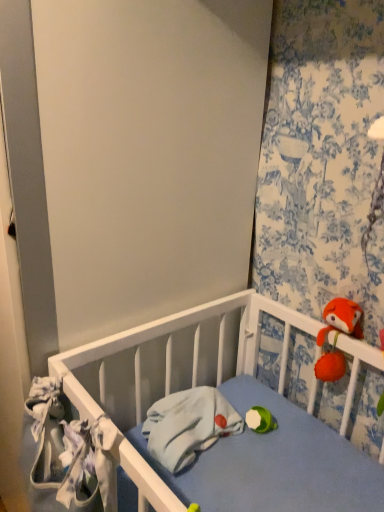
Image resolution: width=384 pixels, height=512 pixels. In order to click on fluffy orange plush at upper right in this screenshot , I will do `click(341, 319)`.

Describe the element at coordinates (322, 160) in the screenshot. I see `floral fabric curtain at upper right` at that location.

Measure the distance between point (50, 412) and camera.

Point (50, 412) is 33.27 inches away from camera.

At what (x,y) coordinates should I click in order to perform the action: click on fluffy orange plush at upper right. Please return your answer as a coordinate pair (x, y). Looking at the image, I should click on (341, 319).

How different are the orientations of fluffy orange plush at upper right and light blue fabric at center, which ranks as the second material in left-to-right order, in degrees?

fluffy orange plush at upper right and light blue fabric at center, which ranks as the second material in left-to-right order, are facing 90.9 degrees away from each other.

Considering the sizes of fluffy orange plush at upper right and light blue fabric at center, arranged as the first material when viewed from the right, in the image, is fluffy orange plush at upper right bigger or smaller than light blue fabric at center, arranged as the first material when viewed from the right,?

fluffy orange plush at upper right is smaller than light blue fabric at center, arranged as the first material when viewed from the right.

Which point is more forward, (x=354, y=334) or (x=159, y=453)?

Point (x=159, y=453)

Considering the relative sizes of fluffy orange plush at upper right and light blue fabric at center, which appears as the second material when viewed from the front, in the image provided, is fluffy orange plush at upper right thinner than light blue fabric at center, which appears as the second material when viewed from the front,?

Yes.

Can you confirm if fluffy orange plush at upper right is taller than white fabric at left, arranged as the second material when viewed from the right?

In fact, fluffy orange plush at upper right may be shorter than white fabric at left, arranged as the second material when viewed from the right.

The height and width of the screenshot is (512, 384). I want to click on material that is the 2nd object to the left of the fluffy orange plush at upper right, starting at the anchor, so click(x=65, y=453).

Measure the distance between fluffy orange plush at upper right and white fabric at left, positioned as the first material in front-to-back order.

fluffy orange plush at upper right is 23.30 inches from white fabric at left, positioned as the first material in front-to-back order.

From the image's perspective, between fluffy orange plush at upper right and white fabric at left, which is counted as the first material, starting from the left, who is located below?

From the image's view, white fabric at left, which is counted as the first material, starting from the left, is below.

Can we say light blue fabric at center, which is the 1th material in back-to-front order, lies outside fluffy orange plush at upper right?

Yes.

Considering the relative sizes of light blue fabric at center, which ranks as the second material in left-to-right order, and fluffy orange plush at upper right in the image provided, is light blue fabric at center, which ranks as the second material in left-to-right order, thinner than fluffy orange plush at upper right?

Incorrect, the width of light blue fabric at center, which ranks as the second material in left-to-right order, is not less than that of fluffy orange plush at upper right.

Does light blue fabric at center, which ranks as the second material in left-to-right order, appear on the right side of fluffy orange plush at upper right?

No.

Is light blue fabric at center, which is the 1th material in back-to-front order, turned away from fluffy orange plush at upper right?

No, light blue fabric at center, which is the 1th material in back-to-front order, is not facing away from fluffy orange plush at upper right.

From the image's perspective, is white fabric at left, marked as the 2th material in a back-to-front arrangement, below floral fabric curtain at upper right?

Yes, from the image's perspective, white fabric at left, marked as the 2th material in a back-to-front arrangement, is beneath floral fabric curtain at upper right.

Is white fabric at left, which is counted as the first material, starting from the left, wider than floral fabric curtain at upper right?

Indeed, white fabric at left, which is counted as the first material, starting from the left, has a greater width compared to floral fabric curtain at upper right.

Is white fabric at left, arranged as the second material when viewed from the right, smaller than floral fabric curtain at upper right?

Yes, white fabric at left, arranged as the second material when viewed from the right, is smaller than floral fabric curtain at upper right.

Considering the sizes of objects white fabric at left, positioned as the first material in front-to-back order, and floral fabric curtain at upper right in the image provided, who is shorter, white fabric at left, positioned as the first material in front-to-back order, or floral fabric curtain at upper right?

white fabric at left, positioned as the first material in front-to-back order, is shorter.

Is point (145, 434) behind point (367, 81)?

That is True.

Is light blue fabric at center, which is the 1th material in back-to-front order, not near floral fabric curtain at upper right?

No, light blue fabric at center, which is the 1th material in back-to-front order, is in close proximity to floral fabric curtain at upper right.

How different are the orientations of light blue fabric at center, which appears as the second material when viewed from the front, and floral fabric curtain at upper right in degrees?

The facing directions of light blue fabric at center, which appears as the second material when viewed from the front, and floral fabric curtain at upper right are 94.7 degrees apart.

This screenshot has width=384, height=512. I want to click on curtain lying on the right of light blue fabric at center, which ranks as the second material in left-to-right order, so click(322, 160).

The width and height of the screenshot is (384, 512). Identify the location of material lying behind the floral fabric curtain at upper right. (188, 425).

Who is smaller, floral fabric curtain at upper right or light blue fabric at center, which ranks as the second material in left-to-right order?

light blue fabric at center, which ranks as the second material in left-to-right order.

Is point (319, 125) positioned behind point (196, 434)?

No, (319, 125) is in front of (196, 434).

Which of these two, floral fabric curtain at upper right or light blue fabric at center, which ranks as the second material in left-to-right order, stands taller?

Standing taller between the two is floral fabric curtain at upper right.

Choose the correct answer: Is white fabric at left, positioned as the first material in front-to-back order, inside light blue fabric at center, which is the 1th material in back-to-front order, or outside it?

white fabric at left, positioned as the first material in front-to-back order, is spatially situated outside light blue fabric at center, which is the 1th material in back-to-front order.

Is the depth of white fabric at left, which is counted as the first material, starting from the left, less than that of light blue fabric at center, which is the 1th material in back-to-front order?

That is True.

From a real-world perspective, is white fabric at left, marked as the 2th material in a back-to-front arrangement, below light blue fabric at center, which ranks as the second material in left-to-right order?

Incorrect, from a real-world perspective, white fabric at left, marked as the 2th material in a back-to-front arrangement, is higher than light blue fabric at center, which ranks as the second material in left-to-right order.

This screenshot has width=384, height=512. I want to click on toy lying on the right of light blue fabric at center, which appears as the second material when viewed from the front, so click(341, 319).

The height and width of the screenshot is (512, 384). Find the location of `material that is the 1st one when counting downward from the fluffy orange plush at upper right (from the image's perspective)`. material that is the 1st one when counting downward from the fluffy orange plush at upper right (from the image's perspective) is located at coordinates (65, 453).

Consider the image. When comparing their distances from light blue fabric at center, which appears as the second material when viewed from the front, does floral fabric curtain at upper right or fluffy orange plush at upper right seem further?

Among the two, floral fabric curtain at upper right is located further to light blue fabric at center, which appears as the second material when viewed from the front.

Based on their spatial positions, is white fabric at left, positioned as the first material in front-to-back order, or light blue fabric at center, arranged as the first material when viewed from the right, further from floral fabric curtain at upper right?

white fabric at left, positioned as the first material in front-to-back order.

Estimate the real-world distances between objects in this image. Which object is further from floral fabric curtain at upper right, fluffy orange plush at upper right or light blue fabric at center, arranged as the first material when viewed from the right?

The object further to floral fabric curtain at upper right is light blue fabric at center, arranged as the first material when viewed from the right.

From the image, which object appears to be nearer to white fabric at left, which is counted as the first material, starting from the left, floral fabric curtain at upper right or light blue fabric at center, which ranks as the second material in left-to-right order?

light blue fabric at center, which ranks as the second material in left-to-right order, is closer to white fabric at left, which is counted as the first material, starting from the left.

Looking at the image, which one is located closer to fluffy orange plush at upper right, floral fabric curtain at upper right or light blue fabric at center, which appears as the second material when viewed from the front?

floral fabric curtain at upper right lies closer to fluffy orange plush at upper right than the other object.

Looking at the image, which one is located further to light blue fabric at center, which ranks as the second material in left-to-right order, fluffy orange plush at upper right or floral fabric curtain at upper right?

floral fabric curtain at upper right is positioned further to the anchor light blue fabric at center, which ranks as the second material in left-to-right order.

From the image, which object appears to be nearer to white fabric at left, which is counted as the first material, starting from the left, light blue fabric at center, arranged as the first material when viewed from the right, or fluffy orange plush at upper right?

Among the two, light blue fabric at center, arranged as the first material when viewed from the right, is located nearer to white fabric at left, which is counted as the first material, starting from the left.

Looking at the image, which one is located closer to floral fabric curtain at upper right, white fabric at left, arranged as the second material when viewed from the right, or fluffy orange plush at upper right?

→ fluffy orange plush at upper right is closer to floral fabric curtain at upper right.

Identify the location of material situated between white fabric at left, arranged as the second material when viewed from the right, and floral fabric curtain at upper right from left to right. (188, 425).

At what (x,y) coordinates should I click in order to perform the action: click on toy located between white fabric at left, positioned as the first material in front-to-back order, and floral fabric curtain at upper right in the left-right direction. Please return your answer as a coordinate pair (x, y). The image size is (384, 512). Looking at the image, I should click on (341, 319).

You are a GUI agent. You are given a task and a screenshot of the screen. Output one action in this format:
    pyautogui.click(x=<x>, y=<y>)
    Task: Click on the material between white fabric at left, positioned as the first material in front-to-back order, and fluffy orange plush at upper right, in the horizontal direction
    This screenshot has width=384, height=512.
    Given the screenshot: What is the action you would take?
    pyautogui.click(x=188, y=425)

Find the location of a particular element. This screenshot has height=512, width=384. toy between floral fabric curtain at upper right and light blue fabric at center, arranged as the first material when viewed from the right, vertically is located at coordinates (341, 319).